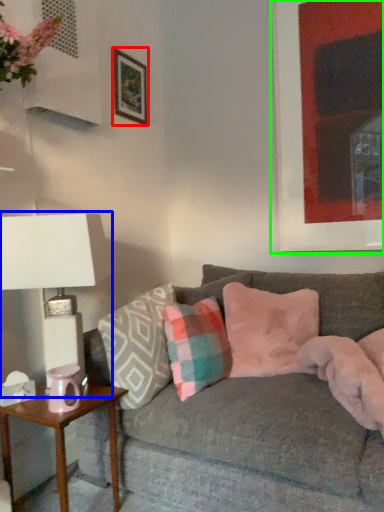
Question: Based on their relative distances, which object is farther from picture frame (highlighted by a red box)? Choose from table lamp (highlighted by a blue box) and picture frame (highlighted by a green box).

Choices:
 (A) table lamp
 (B) picture frame

Answer: (A)